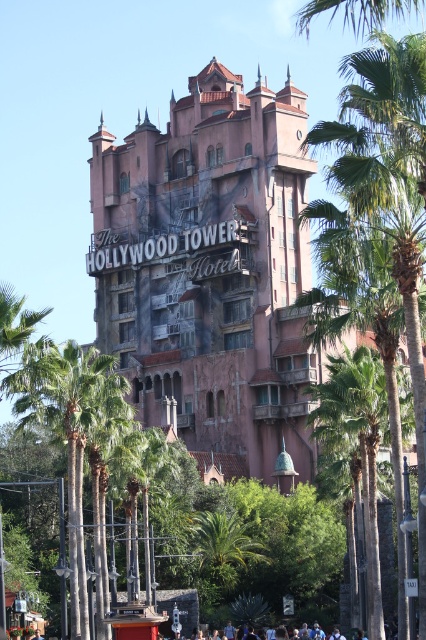
You are standing at point (210, 269) in the image. What is the object located at that point?

The object at point (210, 269) is the pink textured building at center.

Looking at this image, you are standing in front of The Hollywood Tower Hotel and want to take a photo of the sign. The camera you are using has a maximum focus range of 100 meters. Is the point at coordinates point [207,413] within the camera focus range?

The distance of point [207,413] from camera is 100.29 meters, which exceeds the camera maximum focus range of 100 meters. Therefore, the point is out of focus range.

You are standing in front of The Hollywood Tower Hotel and notice the pink textured building at center and the green leafy palm tree at center. Which object is wider?

The pink textured building at center is wider than the green leafy palm tree at center.